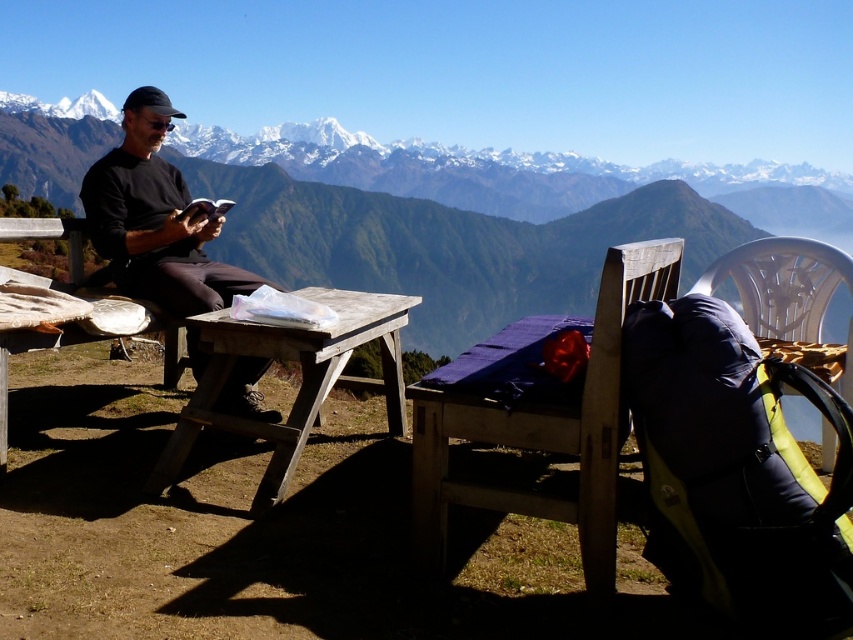
In the scene shown: Is black matte shirt at left taller than wooden picnic table at lower left?

Yes.

Does black matte shirt at left appear on the right side of wooden picnic table at lower left?

Yes, black matte shirt at left is to the right of wooden picnic table at lower left.

The height and width of the screenshot is (640, 853). In order to click on black matte shirt at left in this screenshot , I will do `click(155, 218)`.

Does point (500, 269) come closer to viewer compared to point (26, 340)?

No, it is behind (26, 340).

Can you confirm if snowy mountain range at upper center is thinner than wooden picnic table at lower left?

No.

Does point (485, 266) come in front of point (64, 337)?

That is False.

Identify the location of snowy mountain range at upper center. (447, 232).

Between wooden chair at center and black matte shirt at left, which one is positioned higher?

black matte shirt at left is higher up.

Is wooden chair at center in front of black matte shirt at left?

Yes, wooden chair at center is in front of black matte shirt at left.

Is point (457, 502) less distant than point (146, 292)?

Yes, it is.

At what (x,y) coordinates should I click in order to perform the action: click on wooden chair at center. Please return your answer as a coordinate pair (x, y). Looking at the image, I should click on (544, 429).